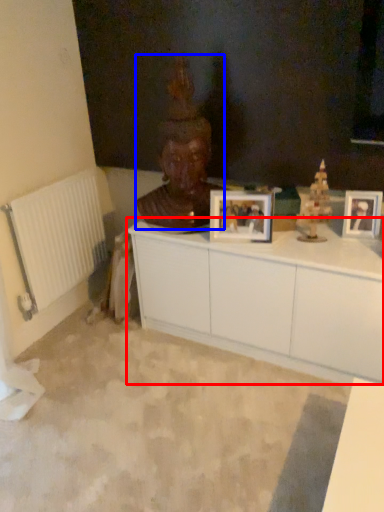
Question: Which point is further to the camera, cabinetry (highlighted by a red box) or person (highlighted by a blue box)?

Choices:
 (A) cabinetry
 (B) person

Answer: (B)